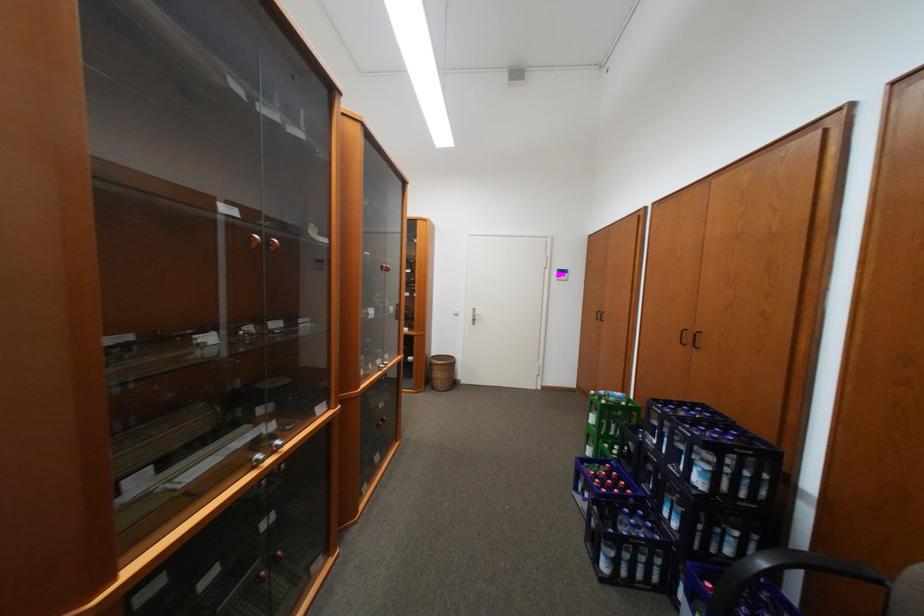
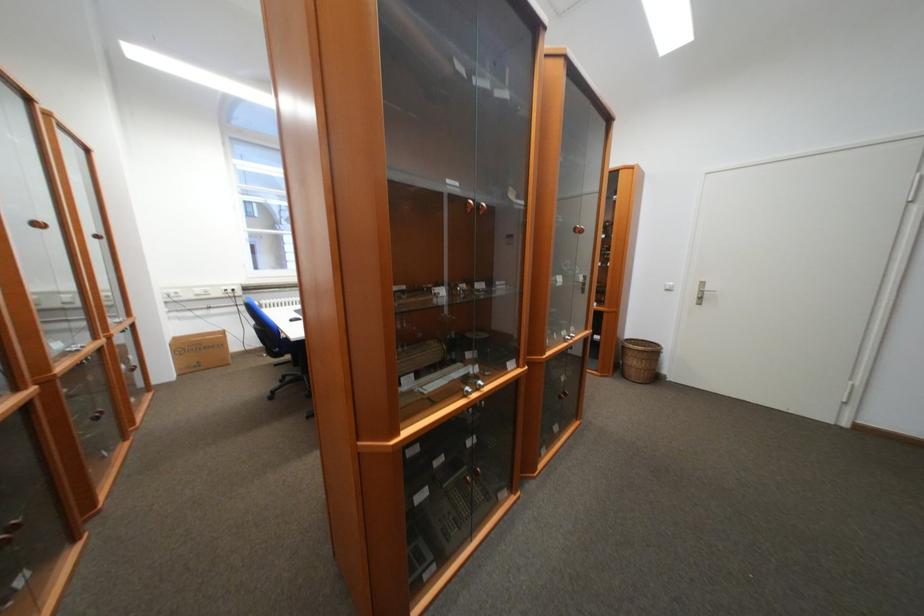
Find the pixel in the second image that matches point (261, 460) in the first image.

(472, 390)